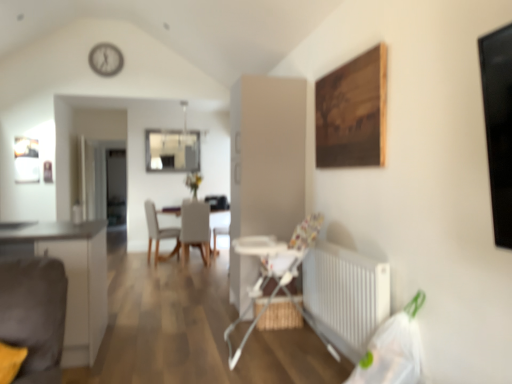
Locate an element on the screen. Image resolution: width=512 pixels, height=384 pixels. free point in front of matte gray chair at center, which ranks as the first chair in right-to-left order is located at coordinates (191, 265).